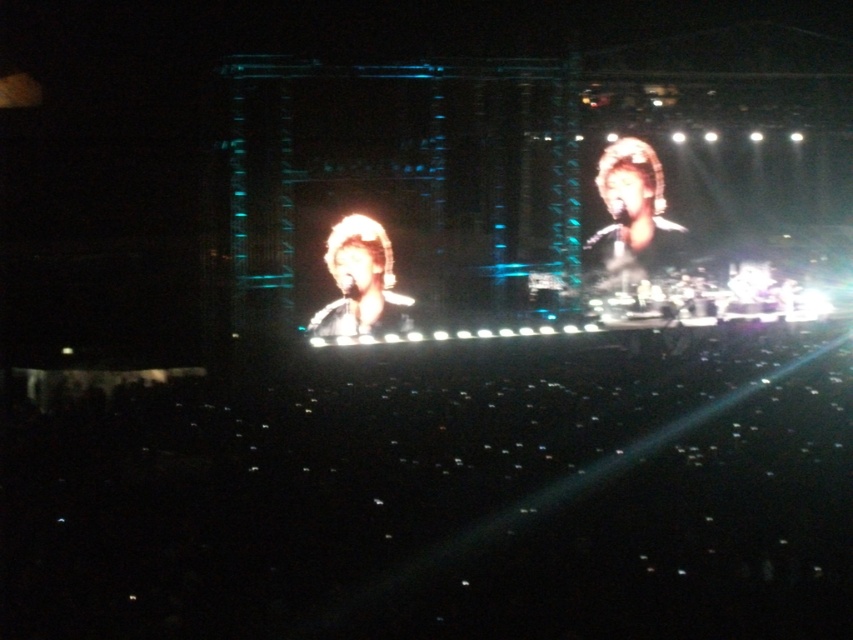
You are a stagehand who needs to choose between the shiny black microphone at center and the shiny gold headband at upper right to place on a narrow shelf that can only hold items up to the width of the headband. Which one should you avoid placing?

You should avoid placing the shiny black microphone at center because its width is larger than the shiny gold headband at upper right, making it too wide for the shelf.

You are a photographer at the concert. You need to capture a photo that includes both the shiny black microphone at center and the shiny gold headband at upper right. Based on their positions, which object should you adjust your camera angle to focus on first to ensure both are in frame?

The shiny black microphone at center is to the left of the shiny gold headband at upper right. To capture both in the frame, adjust your camera angle to focus on the shiny black microphone at center first, then ensure the shiny gold headband at upper right is also visible to the right of it.